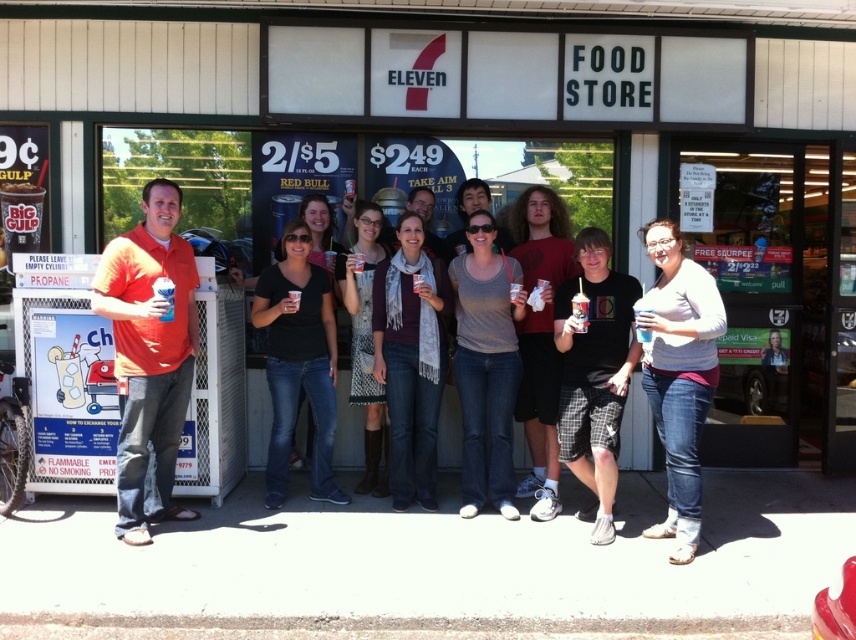
Question: Is light gray sweater at center smaller than clear plastic cup at center?

Choices:
 (A) no
 (B) yes

Answer: (A)

Question: Among these objects, which one is nearest to the camera?

Choices:
 (A) black matte shirt at center
 (B) clear plastic cup at center
 (C) knit scarf at center
 (D) matte black t-shirt at center

Answer: (B)

Question: Does matte black t-shirt at center appear under clear plastic cup at center?

Choices:
 (A) no
 (B) yes

Answer: (B)

Question: Which of these objects is positioned farthest from the gray scarf at center?

Choices:
 (A) gray matte shirt at center
 (B) matte orange shirt at left
 (C) matte plastic cup at center

Answer: (C)

Question: Among these objects, which one is farthest from the camera?

Choices:
 (A) gray scarf at center
 (B) light gray sweater at center
 (C) matte plastic cup at center

Answer: (A)

Question: Can you confirm if matte orange shirt at left is thinner than black cotton t-shirt at center?

Choices:
 (A) yes
 (B) no

Answer: (A)